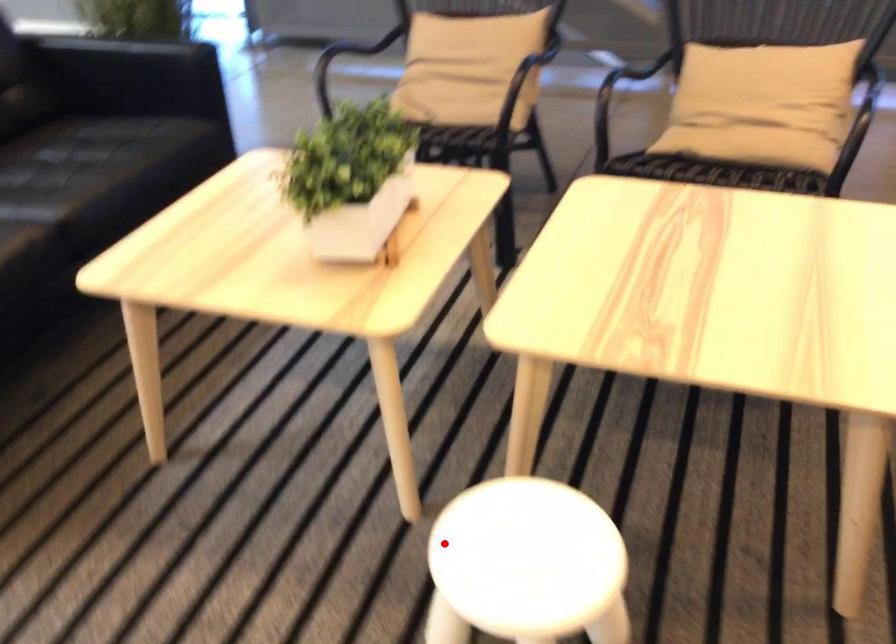
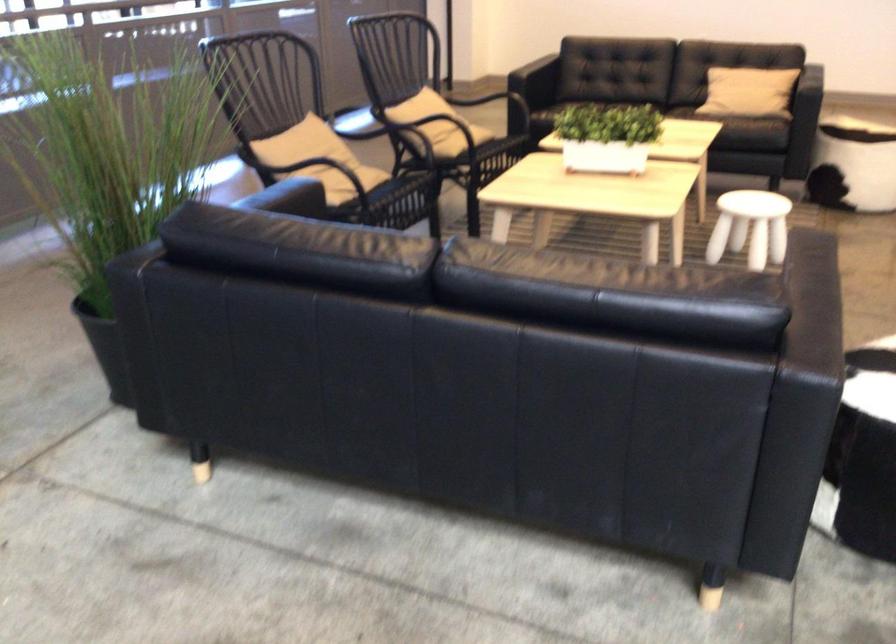
Question: I am providing you with two images of the same scene from different viewpoints. A red point is shown in image1. For the corresponding object point in image2, is it positioned nearer or farther from the camera?

Choices:
 (A) Nearer
 (B) Farther

Answer: (B)